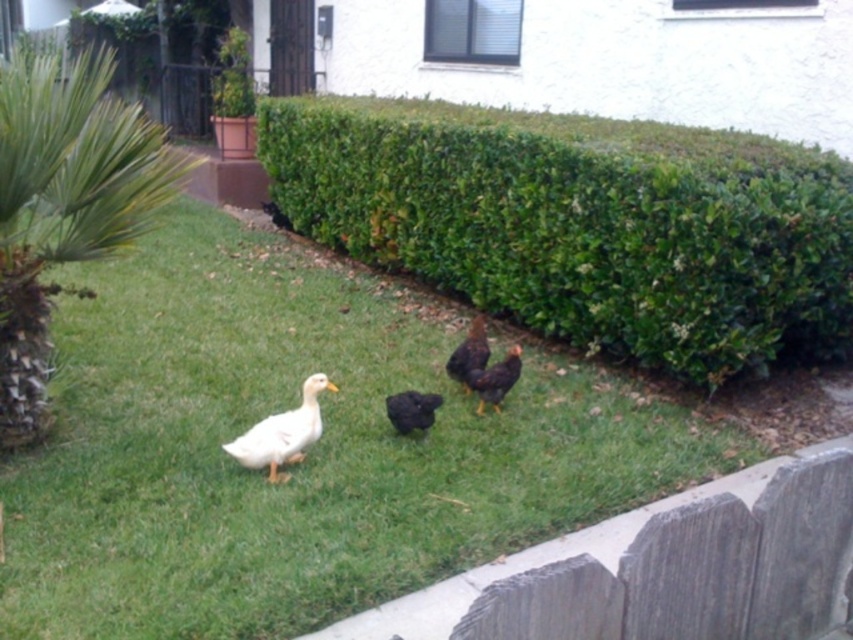
Question: Which object is closer to the camera taking this photo?

Choices:
 (A) white matte duck at center
 (B) green leafy palm tree at left
 (C) brown matte chicken at center

Answer: (B)

Question: Is green leafy hedge at upper center bigger than gray wood fence at lower right?

Choices:
 (A) yes
 (B) no

Answer: (A)

Question: Is green grass at center to the left of green leafy palm tree at left from the viewer's perspective?

Choices:
 (A) no
 (B) yes

Answer: (A)

Question: Can you confirm if green grass at center is wider than white matte duck at lower left?

Choices:
 (A) yes
 (B) no

Answer: (A)

Question: Which object is the farthest from the green grass at center?

Choices:
 (A) black matte duck at center
 (B) brown matte chicken at center
 (C) gray wood fence at lower right

Answer: (C)

Question: Among these points, which one is farthest from the camera?

Choices:
 (A) (288, 417)
 (B) (296, 172)
 (C) (720, 512)

Answer: (B)